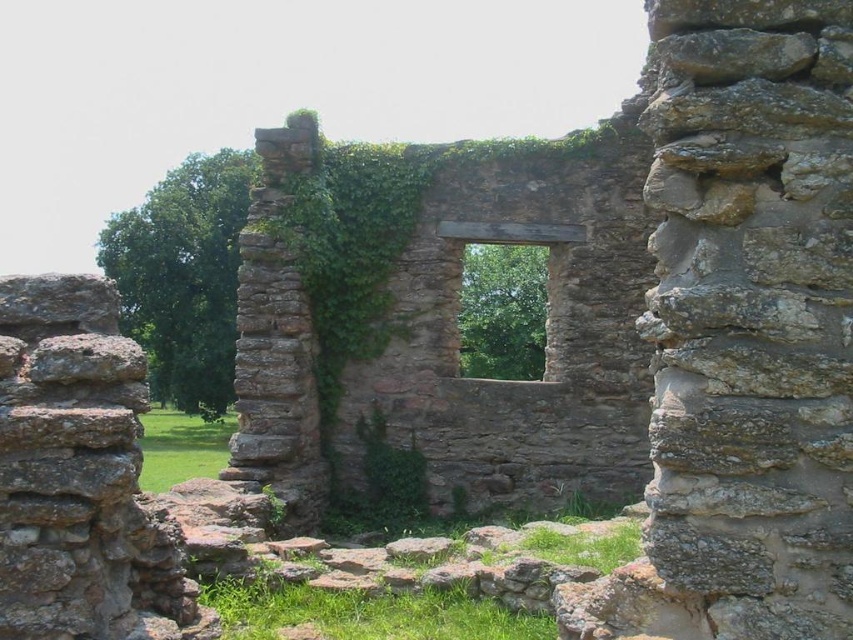
You are an archaeologist examining the ruins of an ancient structure. You notice the green leafy ivy at center and the brown stone window at center. Which object takes up more space in the scene?

The green leafy ivy at center is bigger than the brown stone window at center, so it takes up more space in the scene.